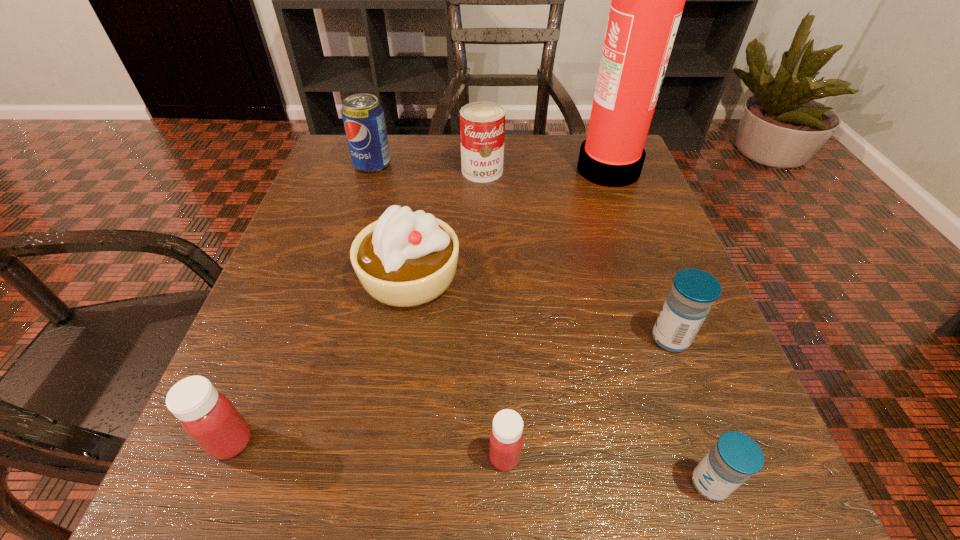
Identify the location of the smaller red medicine. (506, 437).

Image resolution: width=960 pixels, height=540 pixels. Find the location of `the third medicine from right to left`. the third medicine from right to left is located at coordinates (506, 437).

Where is `the nearer blue medicine`? the nearer blue medicine is located at coordinates (735, 457).

Where is `blank space located with the nozzle aimed from the fire extinguisher`? The image size is (960, 540). blank space located with the nozzle aimed from the fire extinguisher is located at coordinates tap(398, 168).

This screenshot has width=960, height=540. Find the location of `free region located with the nozzle aimed from the fire extinguisher`. free region located with the nozzle aimed from the fire extinguisher is located at coordinates (492, 168).

Find the location of a particular element. Image resolution: width=960 pixels, height=540 pixels. vacant point located with the nozzle aimed from the fire extinguisher is located at coordinates pos(488,168).

You are a GUI agent. You are given a task and a screenshot of the screen. Output one action in this format:
    pyautogui.click(x=<x>, y=<y>)
    Task: Click on the free region located on the right of the soda
    
    Given the screenshot: What is the action you would take?
    [x=497, y=165]

What are the coordinates of `vacant space located on the front label of the can` in the screenshot? It's located at (483, 197).

The width and height of the screenshot is (960, 540). I want to click on blank space located 0.180m on the back of the whipped cream, so click(x=423, y=187).

At what (x,y) coordinates should I click in order to perform the action: click on free space located 0.100m on the left of the fifth farthest object. Please return your answer as a coordinate pair (x, y). This screenshot has height=540, width=960. Looking at the image, I should click on (585, 339).